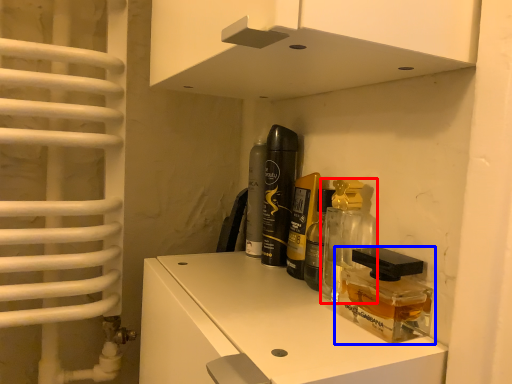
Question: Which object appears closest to the camera in this image, perfume (highlighted by a red box) or product (highlighted by a blue box)?

Choices:
 (A) perfume
 (B) product

Answer: (B)